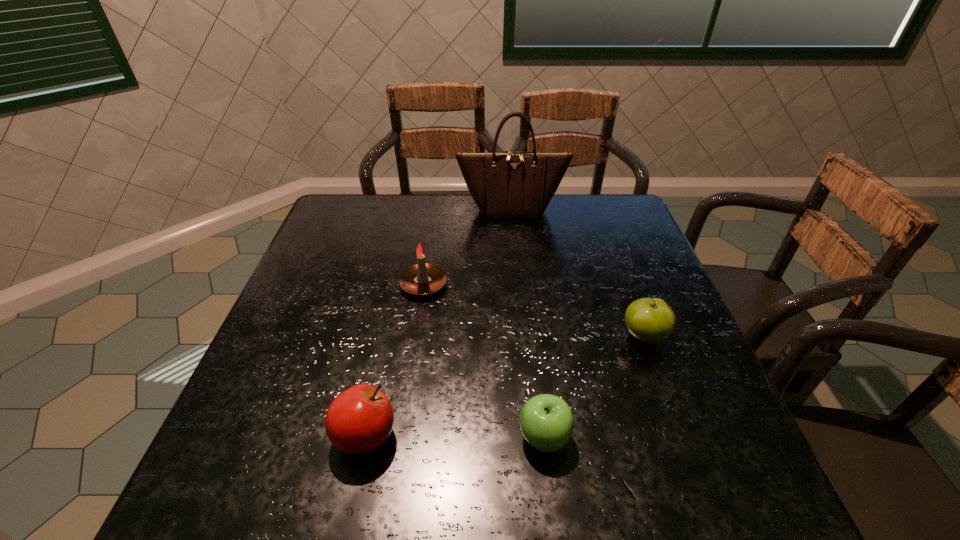
Locate an element on the screen. free space located 0.330m on the right of the leftmost apple is located at coordinates (578, 436).

What are the coordinates of `free space located on the left of the second apple from left to right` in the screenshot? It's located at (310, 437).

Find the location of `object that is at the far edge`. object that is at the far edge is located at coordinates pos(509,184).

Locate an element on the screen. This screenshot has height=540, width=960. object that is at the right edge is located at coordinates (650, 320).

Where is `vacant region at the far edge of the desktop`? This screenshot has height=540, width=960. vacant region at the far edge of the desktop is located at coordinates coord(560,231).

Where is `free location at the near edge of the desktop`? free location at the near edge of the desktop is located at coordinates (553, 495).

In the image, there is a desktop. Identify the location of vacant space at the left edge. Image resolution: width=960 pixels, height=540 pixels. (316, 305).

The height and width of the screenshot is (540, 960). I want to click on vacant space at the right edge of the desktop, so click(x=733, y=432).

In the image, there is a desktop. Where is `vacant region at the far left corner`? vacant region at the far left corner is located at coordinates (344, 202).

The width and height of the screenshot is (960, 540). I want to click on vacant position at the near left corner of the desktop, so click(296, 477).